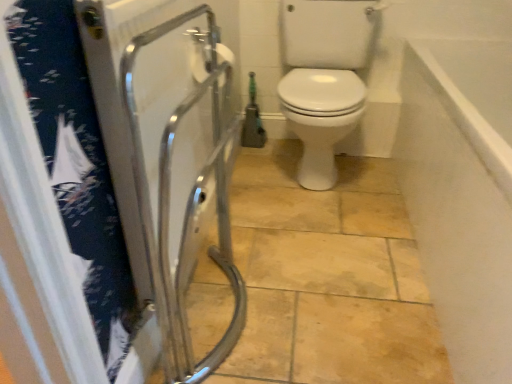
Question: Does transparent plastic screen door at left have a smaller size compared to white matte toilet paper at upper center?

Choices:
 (A) no
 (B) yes

Answer: (A)

Question: Is transparent plastic screen door at left to the right of white matte toilet paper at upper center from the viewer's perspective?

Choices:
 (A) yes
 (B) no

Answer: (A)

Question: Considering the relative sizes of transparent plastic screen door at left and white matte toilet paper at upper center in the image provided, is transparent plastic screen door at left wider than white matte toilet paper at upper center?

Choices:
 (A) no
 (B) yes

Answer: (B)

Question: From the image's perspective, is transparent plastic screen door at left on white matte toilet paper at upper center?

Choices:
 (A) no
 (B) yes

Answer: (A)

Question: From a real-world perspective, does transparent plastic screen door at left sit lower than white matte toilet paper at upper center?

Choices:
 (A) yes
 (B) no

Answer: (A)

Question: From a real-world perspective, is white smooth wall at upper right above or below white matte toilet paper at upper center?

Choices:
 (A) above
 (B) below

Answer: (B)

Question: Visually, is white smooth wall at upper right positioned to the left or to the right of white matte toilet paper at upper center?

Choices:
 (A) right
 (B) left

Answer: (A)

Question: Is point (461, 283) closer or farther from the camera than point (196, 59)?

Choices:
 (A) farther
 (B) closer

Answer: (B)

Question: From the image's perspective, is white smooth wall at upper right positioned above or below white matte toilet paper at upper center?

Choices:
 (A) below
 (B) above

Answer: (A)

Question: Is transparent plastic screen door at left inside the boundaries of white matte toilet paper at upper center, or outside?

Choices:
 (A) outside
 (B) inside

Answer: (A)

Question: In terms of size, does transparent plastic screen door at left appear bigger or smaller than white matte toilet paper at upper center?

Choices:
 (A) big
 (B) small

Answer: (A)

Question: In terms of height, does transparent plastic screen door at left look taller or shorter compared to white matte toilet paper at upper center?

Choices:
 (A) tall
 (B) short

Answer: (A)

Question: Considering their positions, is transparent plastic screen door at left located in front of or behind white matte toilet paper at upper center?

Choices:
 (A) behind
 (B) front

Answer: (B)

Question: From the image's perspective, relative to white smooth wall at upper right, is white matte toilet paper at upper center above or below?

Choices:
 (A) above
 (B) below

Answer: (A)

Question: Is white matte toilet paper at upper center taller or shorter than white smooth wall at upper right?

Choices:
 (A) short
 (B) tall

Answer: (A)